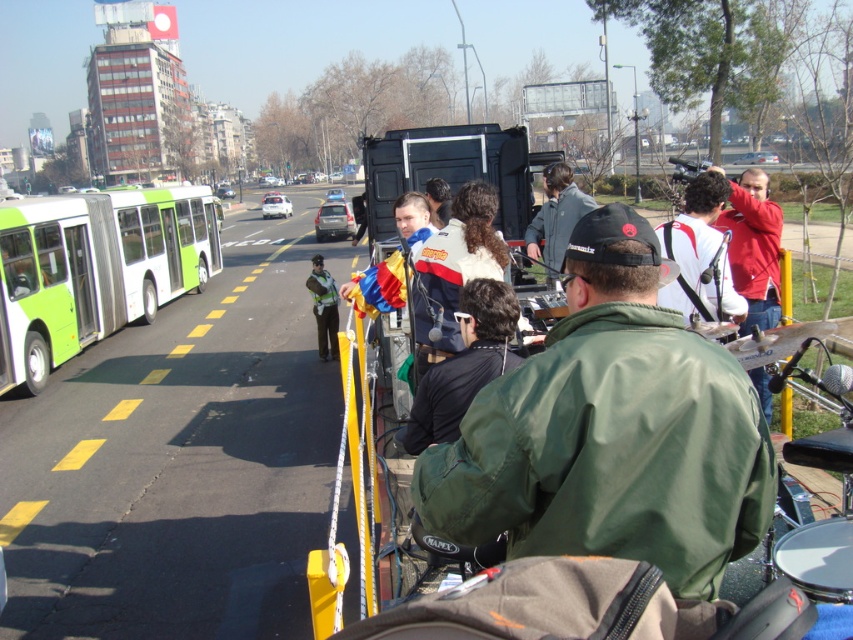
Question: Among these points, which one is farthest from the camera?

Choices:
 (A) (561, 256)
 (B) (695, 198)
 (C) (432, 211)

Answer: (A)

Question: Is green matte jacket at center positioned in front of green matte bus at left?

Choices:
 (A) yes
 (B) no

Answer: (A)

Question: Which of the following is the farthest from the observer?

Choices:
 (A) (444, 209)
 (B) (584, 216)
 (C) (335, 300)

Answer: (C)

Question: Which point is closer to the camera taking this photo?

Choices:
 (A) (314, 278)
 (B) (747, 173)

Answer: (B)

Question: Considering the relative positions of red jacket at upper right and dark brown leather jacket at upper center in the image provided, where is red jacket at upper right located with respect to dark brown leather jacket at upper center?

Choices:
 (A) above
 (B) below

Answer: (B)

Question: Does green matte jacket at center appear over dark brown leather jacket at upper center?

Choices:
 (A) no
 (B) yes

Answer: (A)